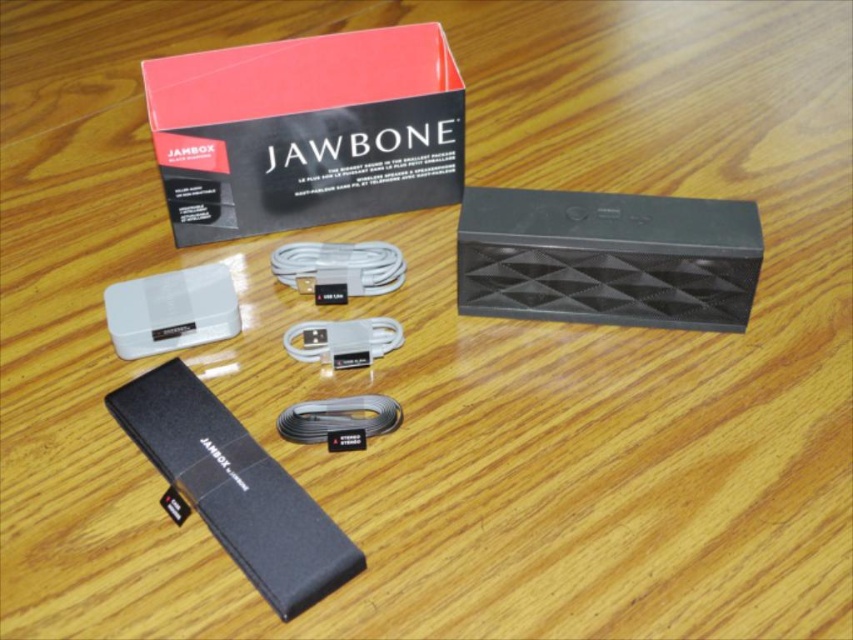
Question: Does matte black box at upper center have a lesser width compared to black matte battery at lower left?

Choices:
 (A) yes
 (B) no

Answer: (B)

Question: Which point is farther from the camera taking this photo?

Choices:
 (A) (345, 346)
 (B) (303, 435)
 (C) (300, 289)
 (D) (492, 211)

Answer: (C)

Question: Which is farther from the satin silver cable at center?

Choices:
 (A) black matte battery at lower left
 (B) matte black box at upper center

Answer: (B)

Question: Which point appears closest to the camera in this image?

Choices:
 (A) (251, 554)
 (B) (660, 253)
 (C) (366, 416)
 (D) (297, 243)

Answer: (A)

Question: Does matte black box at upper center have a smaller size compared to white matte usb cable at center?

Choices:
 (A) yes
 (B) no

Answer: (B)

Question: Is satin silver cable at center thinner than white matte usb cable at center?

Choices:
 (A) no
 (B) yes

Answer: (B)